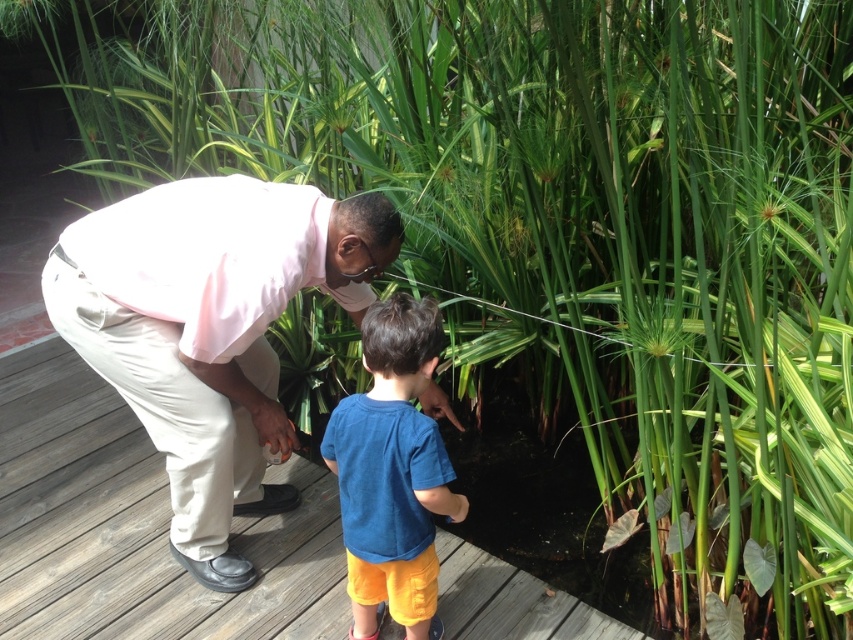
Question: Estimate the real-world distances between objects in this image. Which object is farther from the pink cotton shirt at center?

Choices:
 (A) blue cotton shirt at center
 (B) wooden deck at center

Answer: (B)

Question: Considering the real-world distances, which object is closest to the pink cotton shirt at center?

Choices:
 (A) blue cotton shirt at center
 (B) wooden deck at center

Answer: (A)

Question: Can you confirm if wooden deck at center is wider than blue cotton shirt at center?

Choices:
 (A) no
 (B) yes

Answer: (B)

Question: Does pink cotton shirt at center have a lesser width compared to blue cotton shirt at center?

Choices:
 (A) no
 (B) yes

Answer: (A)

Question: Estimate the real-world distances between objects in this image. Which object is farther from the wooden deck at center?

Choices:
 (A) pink cotton shirt at center
 (B) blue cotton shirt at center

Answer: (A)

Question: Is wooden deck at center below blue cotton shirt at center?

Choices:
 (A) no
 (B) yes

Answer: (B)